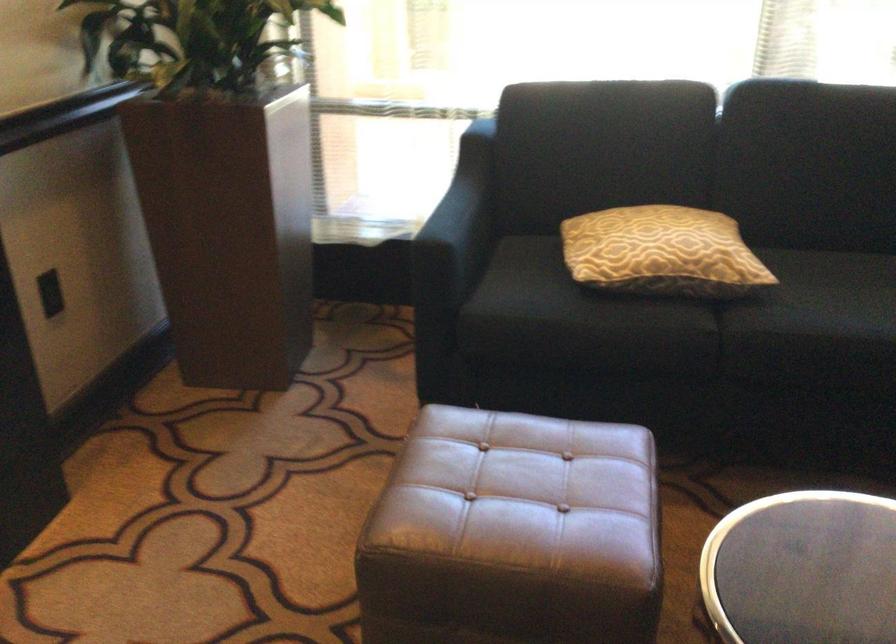
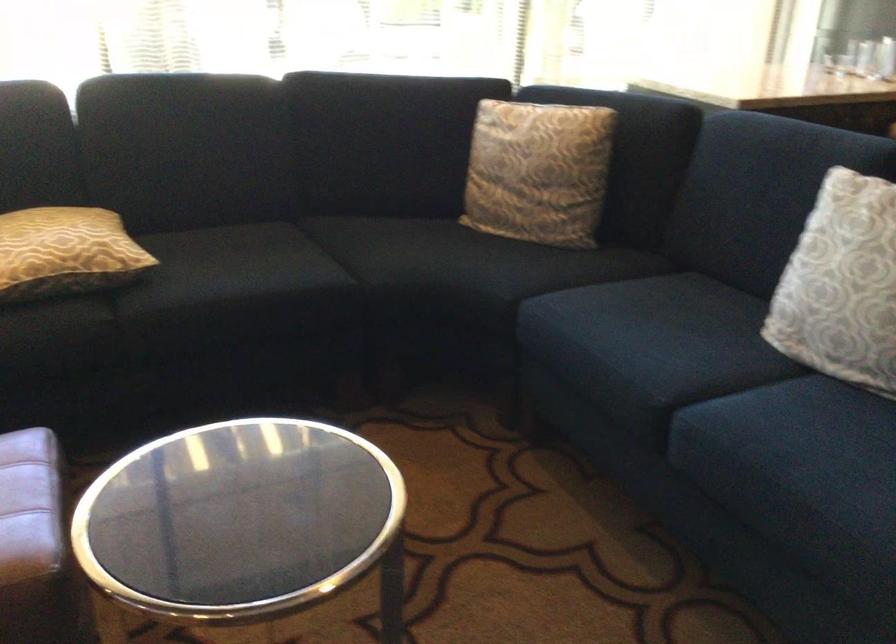
Question: The camera is either moving clockwise (left) or counter-clockwise (right) around the object. The first image is from the beginning of the video and the second image is from the end. Is the camera moving left or right when shooting the video?

Choices:
 (A) Left
 (B) Right

Answer: (A)